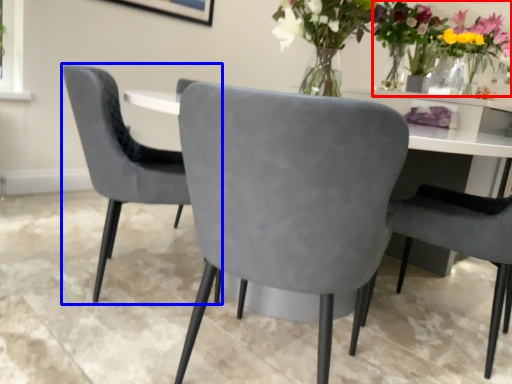
Question: Among these objects, which one is nearest to the camera, floral arrangement (highlighted by a red box) or chair (highlighted by a blue box)?

Choices:
 (A) floral arrangement
 (B) chair

Answer: (B)